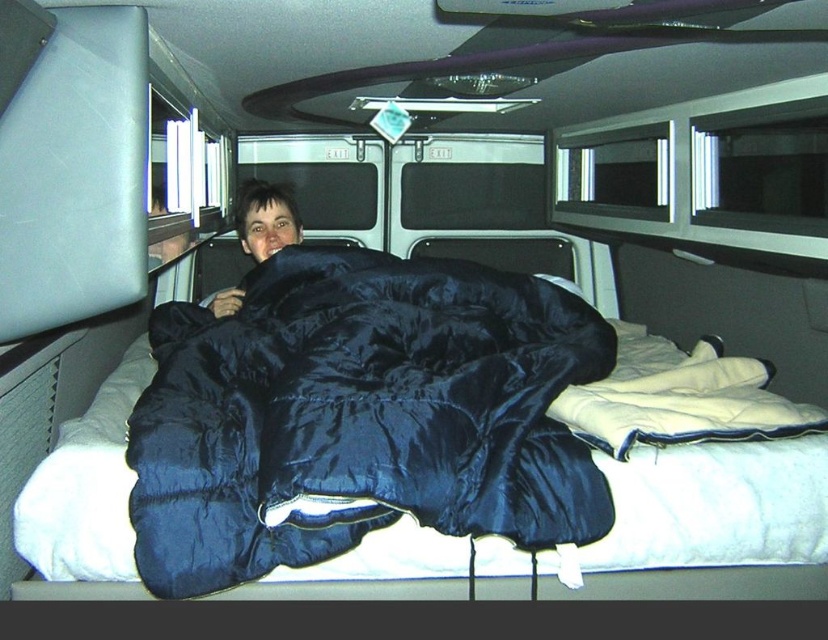
Question: Among these points, which one is farthest from the camera?

Choices:
 (A) (248, 209)
 (B) (179, 529)

Answer: (A)

Question: Does black silky sleeping bag at center appear on the right side of matte black sleeping bag at center?

Choices:
 (A) no
 (B) yes

Answer: (B)

Question: Considering the relative positions of black silky sleeping bag at center and matte black sleeping bag at center in the image provided, where is black silky sleeping bag at center located with respect to matte black sleeping bag at center?

Choices:
 (A) above
 (B) below

Answer: (B)

Question: Can you confirm if black silky sleeping bag at center is positioned to the right of matte black sleeping bag at center?

Choices:
 (A) no
 (B) yes

Answer: (B)

Question: Which point is farther from the camera taking this photo?

Choices:
 (A) (290, 188)
 (B) (546, 451)

Answer: (A)